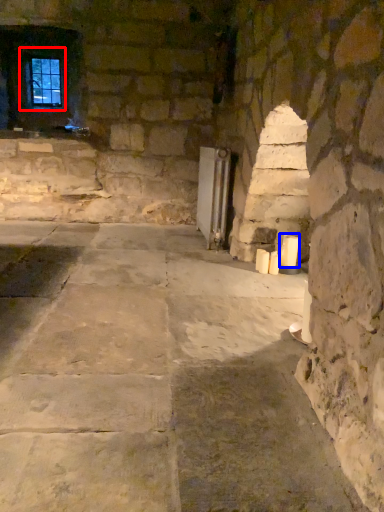
Question: Which of the following is the farthest to the observer, window (highlighted by a red box) or candle (highlighted by a blue box)?

Choices:
 (A) window
 (B) candle

Answer: (A)